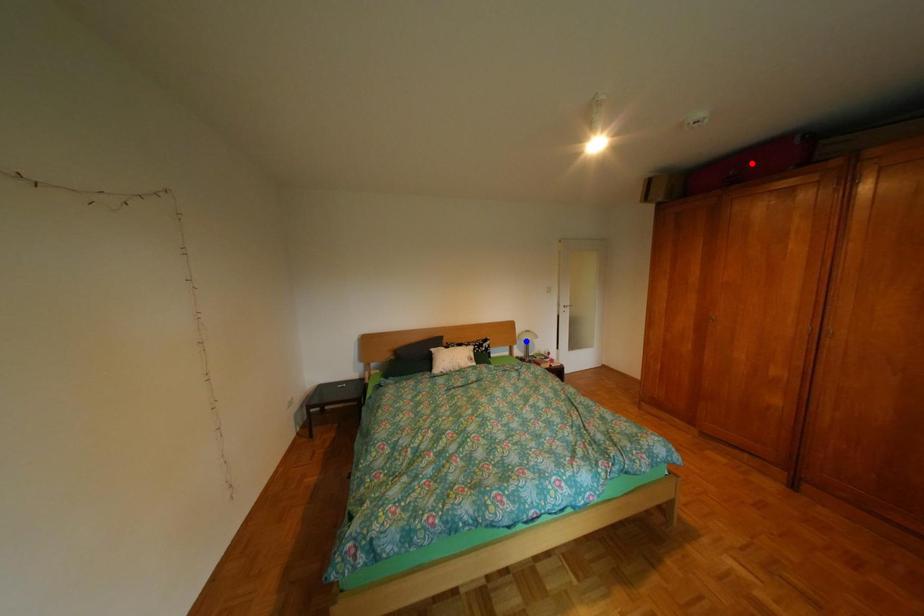
Question: In the image, two points are highlighted. Which point is nearer to the camera? Reply with the corresponding letter.

Choices:
 (A) blue point
 (B) red point

Answer: (B)